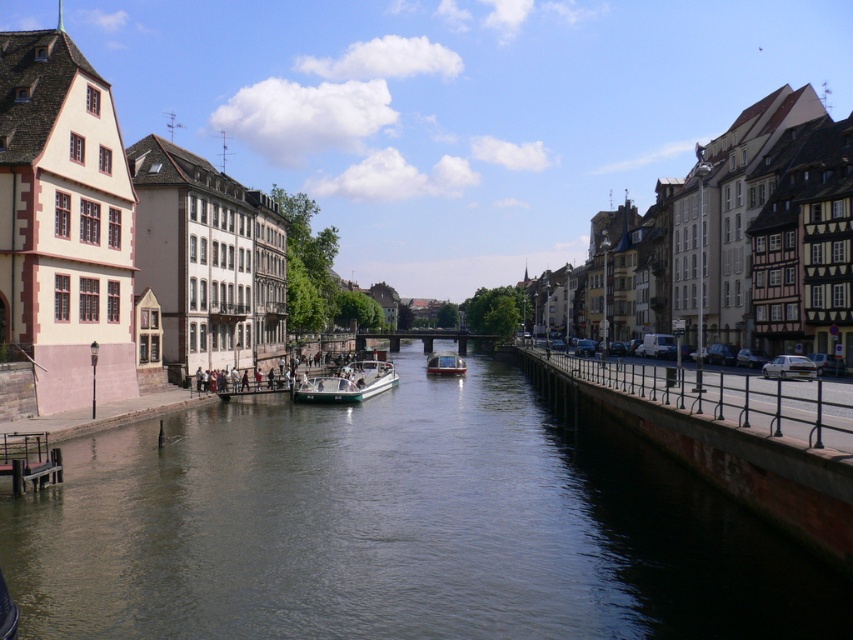
Question: Is greenish-gray water at center further to camera compared to metallic polished boat at center?

Choices:
 (A) yes
 (B) no

Answer: (B)

Question: Can you confirm if greenish-gray water at center is smaller than green matte boat at center?

Choices:
 (A) yes
 (B) no

Answer: (B)

Question: Is green matte boat at center to the right of metallic polished boat at center from the viewer's perspective?

Choices:
 (A) no
 (B) yes

Answer: (A)

Question: Which of the following is the closest to the observer?

Choices:
 (A) greenish-gray water at center
 (B) metallic polished boat at center
 (C) green matte boat at center

Answer: (A)

Question: Which of the following is the farthest from the observer?

Choices:
 (A) green matte boat at center
 (B) greenish-gray water at center
 (C) metallic polished boat at center

Answer: (C)

Question: Which object is farther from the camera taking this photo?

Choices:
 (A) greenish-gray water at center
 (B) metallic polished boat at center

Answer: (B)